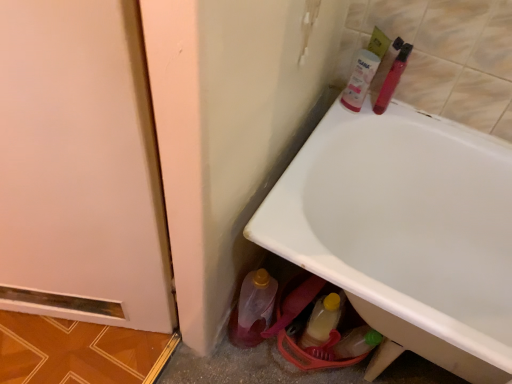
You are a GUI agent. You are given a task and a screenshot of the screen. Output one action in this format:
    pyautogui.click(x=<x>, y=<y>)
    Task: Click on the unoccupied area in front of pink plastic tube at upper right, the 2th mouthwash viewed from the right
    Image resolution: width=512 pixels, height=384 pixels.
    Given the screenshot: What is the action you would take?
    pyautogui.click(x=332, y=132)